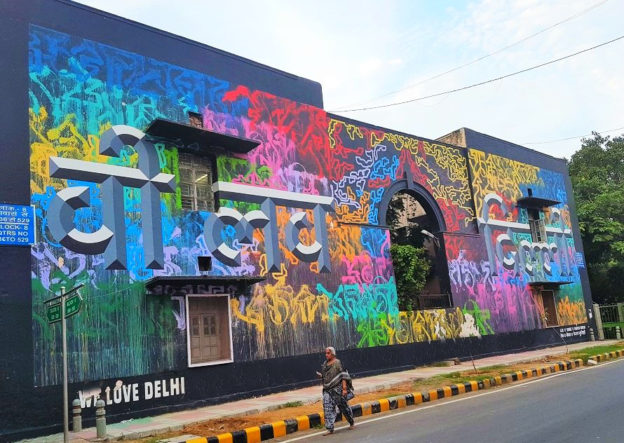
Identify the location of windows. Image resolution: width=624 pixels, height=443 pixels. (205, 345), (547, 310), (198, 192), (535, 229).